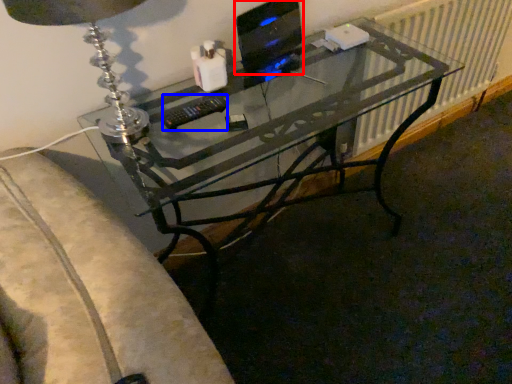
Question: Which object is closer to the camera taking this photo, computer monitor (highlighted by a red box) or control (highlighted by a blue box)?

Choices:
 (A) computer monitor
 (B) control

Answer: (B)